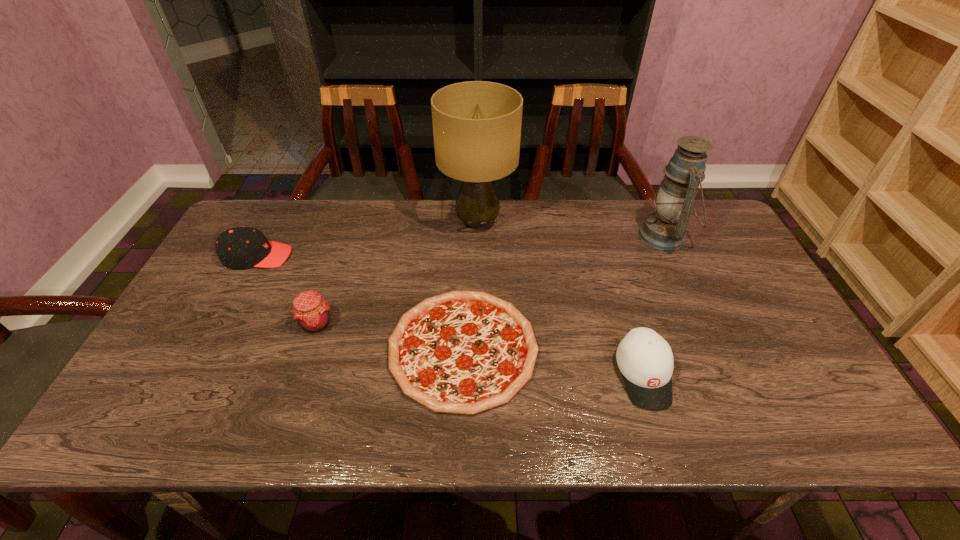
Locate an element on the screen. Image resolution: width=960 pixels, height=540 pixels. empty space that is in between the shortest object and the leftmost object is located at coordinates (360, 302).

What are the coordinates of `vacant space that's between the fifth object from left to right and the tallest object` in the screenshot? It's located at (561, 299).

The width and height of the screenshot is (960, 540). Find the location of `free point between the tallest object and the second object from right to left`. free point between the tallest object and the second object from right to left is located at coordinates (561, 299).

The height and width of the screenshot is (540, 960). In order to click on free space between the jam and the second tallest object in this screenshot , I will do `click(491, 280)`.

At what (x,y) coordinates should I click in order to perform the action: click on unoccupied position between the oil lamp and the baseball cap. Please return your answer as a coordinate pair (x, y). The image size is (960, 540). Looking at the image, I should click on (654, 305).

Locate which object is the second closest to the second object from right to left. Please provide its 2D coordinates. Your answer should be formatted as a tuple, i.e. [(x, y)], where the tuple contains the x and y coordinates of a point satisfying the conditions above.

[(665, 229)]

Locate an element on the screen. This screenshot has width=960, height=540. object that is the closest to the second object from right to left is located at coordinates (463, 352).

You are a GUI agent. You are given a task and a screenshot of the screen. Output one action in this format:
    pyautogui.click(x=<x>, y=<y>)
    Task: Click on the vacant point that satisfies the following two spatial constraints: 1. on the front-facing side of the jam; 2. on the left side of the cap
    The height and width of the screenshot is (540, 960).
    Given the screenshot: What is the action you would take?
    pyautogui.click(x=221, y=324)

I want to click on vacant space that satisfies the following two spatial constraints: 1. on the back side of the jam; 2. on the right side of the lampshade, so [350, 222].

Find the location of a particular element. This screenshot has height=540, width=960. free point that satisfies the following two spatial constraints: 1. on the front-facing side of the pizza; 2. on the left side of the leftmost object is located at coordinates (208, 348).